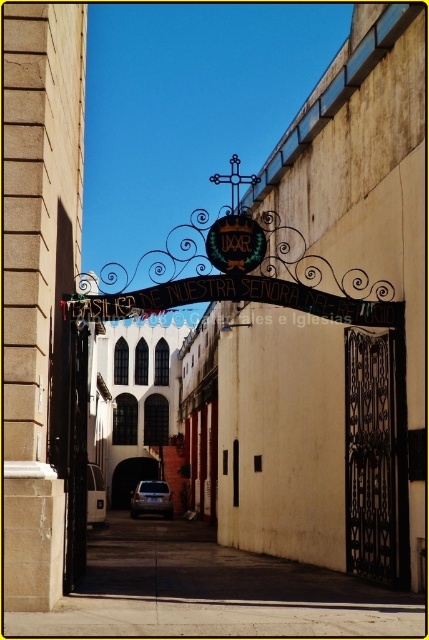
Question: Which object is farther from the camera taking this photo?

Choices:
 (A) black metal gate at lower left
 (B) black wrought iron gate at center

Answer: (B)

Question: Is black metal gate at lower left positioned at the back of metallic silver car at center?

Choices:
 (A) no
 (B) yes

Answer: (A)

Question: Can you confirm if black metal gate at lower left is positioned to the right of metallic silver car at center?

Choices:
 (A) no
 (B) yes

Answer: (B)

Question: Which point is farther to the camera?

Choices:
 (A) metallic silver car at center
 (B) black metal gate at lower left
 (C) black wrought iron gate at center

Answer: (A)

Question: Which of the following is the farthest from the observer?

Choices:
 (A) (72, 513)
 (B) (374, 387)
 (C) (141, 506)

Answer: (C)

Question: Considering the relative positions of black wrought iron gate at center and metallic silver car at center in the image provided, where is black wrought iron gate at center located with respect to metallic silver car at center?

Choices:
 (A) left
 (B) right

Answer: (B)